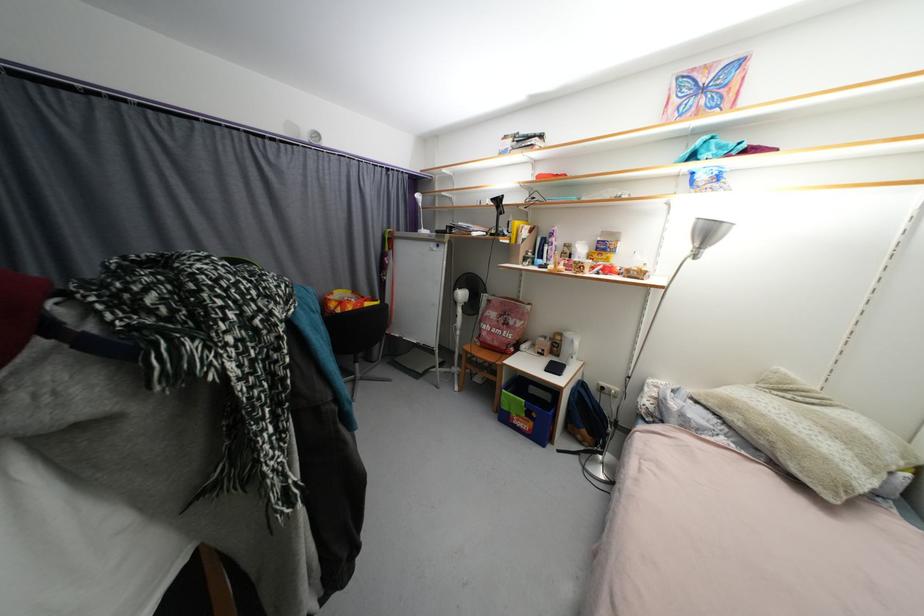
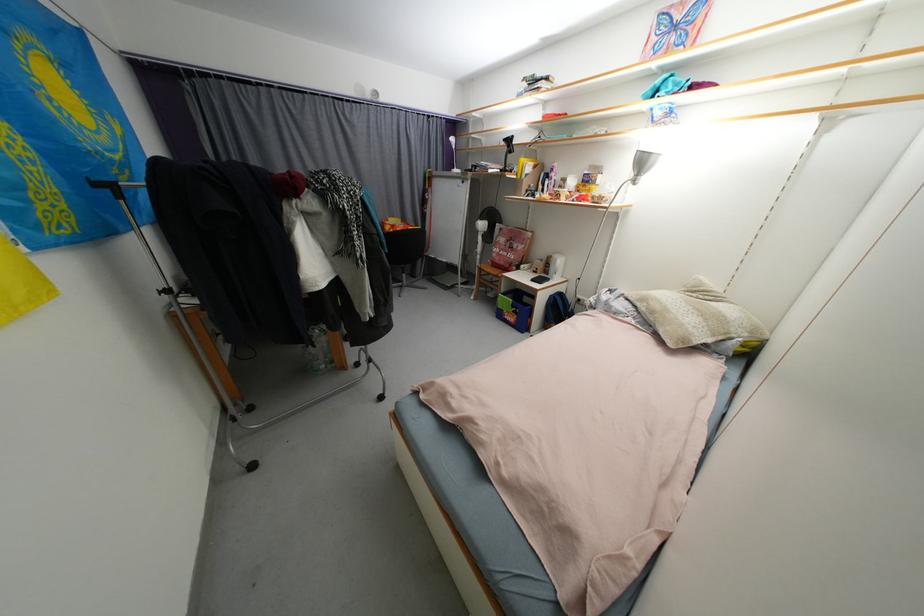
The point at (588, 387) is marked in the first image. Where is the corresponding point in the second image?

(565, 297)